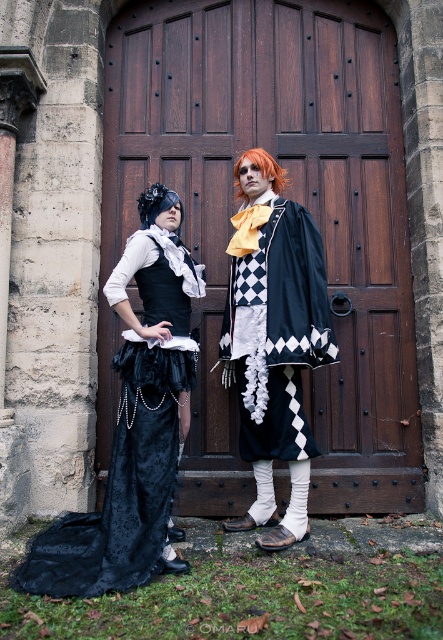
You are an event planner setting up a photoshoot in front of the large dark wooden door. You need to place a decorative archway 1.2 meters to the right of the black velvet dress at left. Where should you place the archway?

The black velvet dress at left is positioned at point (121, 486). To place the archway 1.2 meters to the right, you should position it at coordinates approximately (121, 639).

You are a costume designer observing the scene. You need to determine which object occupies more space in the image. Which is larger in size between the brown wooden door at center and the black velvet coat at center?

The brown wooden door at center is larger in size than the black velvet coat at center.